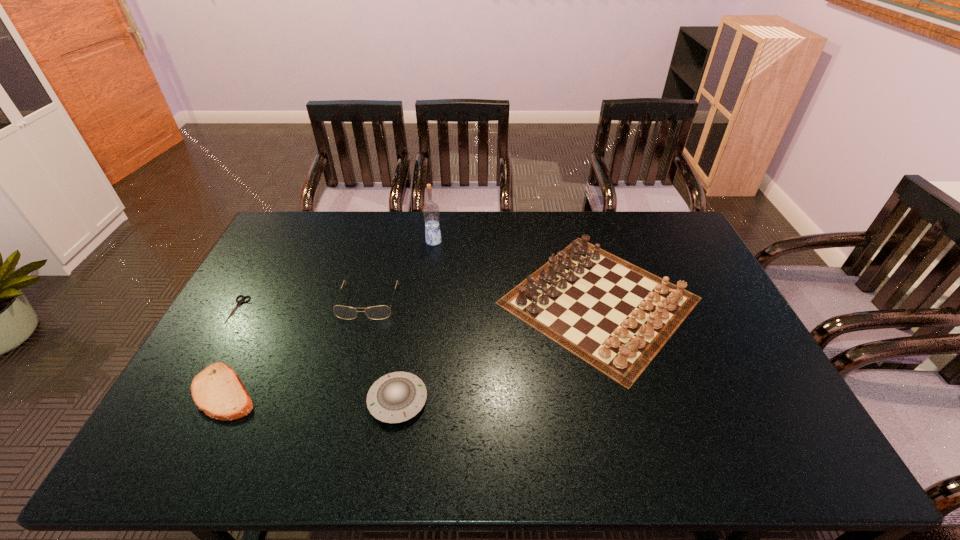
Image resolution: width=960 pixels, height=540 pixels. I want to click on the tallest object, so click(431, 212).

Where is `the rightmost object`? The image size is (960, 540). the rightmost object is located at coordinates (617, 319).

Identify the location of the fifth shortest object. This screenshot has height=540, width=960. (617, 319).

At what (x,y) coordinates should I click in order to perform the action: click on the third tallest object. Please return your answer as a coordinate pair (x, y). This screenshot has width=960, height=540. Looking at the image, I should click on (380, 312).

Image resolution: width=960 pixels, height=540 pixels. I want to click on saucer, so click(396, 397).

Where is `pita bread`? pita bread is located at coordinates (217, 390).

At what (x,y) coordinates should I click in order to perform the action: click on the shortest object. Please return your answer as a coordinate pair (x, y). The height and width of the screenshot is (540, 960). Looking at the image, I should click on (239, 302).

At what (x,y) coordinates should I click in order to perform the action: click on vacant area situated 0.160m on the right of the vodka. Please return your answer as a coordinate pair (x, y). The image size is (960, 540). Looking at the image, I should click on (485, 241).

Identify the location of vacant region located 0.110m on the front of the chessboard. (636, 428).

You are a GUI agent. You are given a task and a screenshot of the screen. Output one action in this format:
    pyautogui.click(x=<x>, y=<y>)
    Task: Click on the vacant area situated on the front-facing side of the third tallest object
    
    Given the screenshot: What is the action you would take?
    pyautogui.click(x=353, y=358)